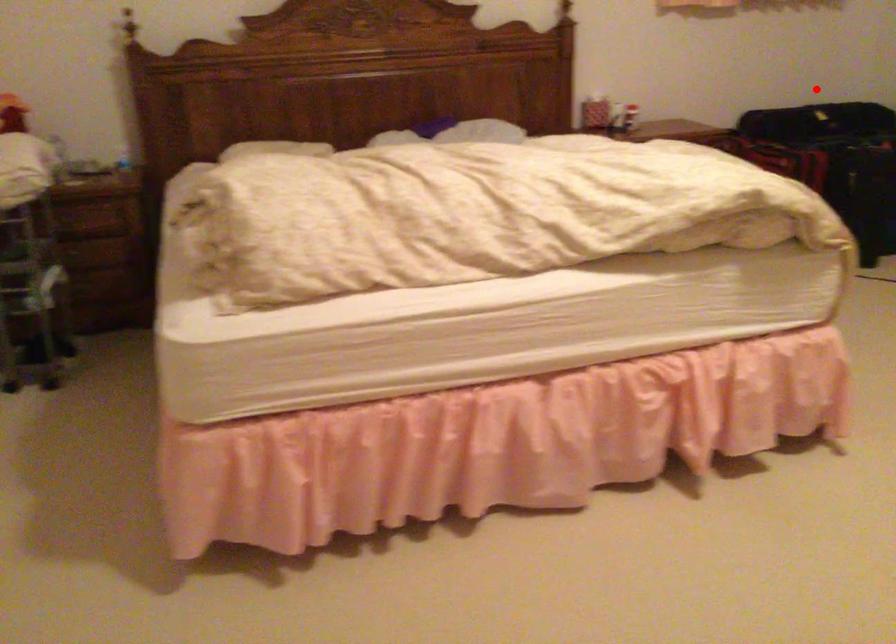
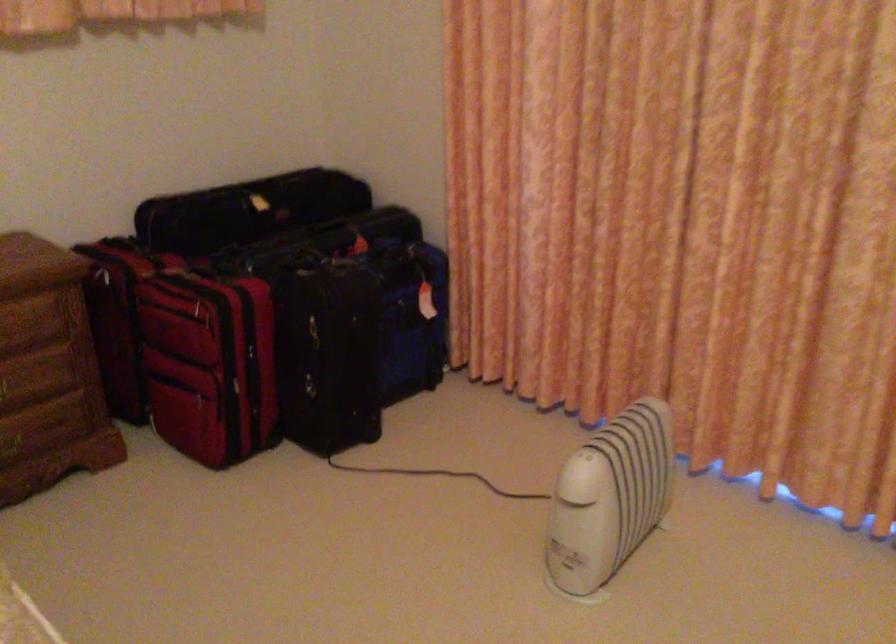
Question: I am providing you with two images of the same scene from different viewpoints. A red point is shown in image1. For the corresponding object point in image2, is it positioned nearer or farther from the camera?

Choices:
 (A) Nearer
 (B) Farther

Answer: (A)